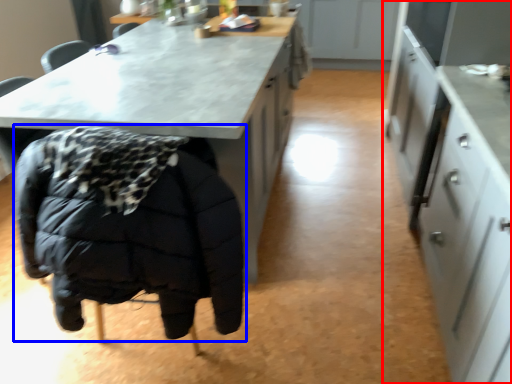
Question: Which of the following is the farthest to the observer, cabinetry (highlighted by a red box) or jacket (highlighted by a blue box)?

Choices:
 (A) cabinetry
 (B) jacket

Answer: (B)